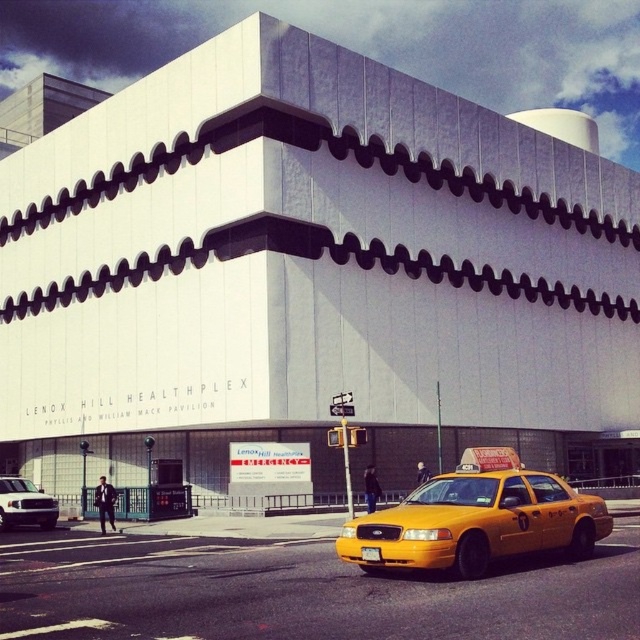
You are a delivery person who needs to park a vehicle that is 2 meters wide. You see the yellow matte taxi at center and the white matte truck at lower left. Which vehicle can accommodate your delivery vehicle based on width?

The yellow matte taxi at center has a larger width than the white matte truck at lower left, so the delivery vehicle that is 2 meters wide can fit in the yellow matte taxi at center parking space.

You are a delivery person who needs to park your vehicle in a space that can accommodate your truck. You see the yellow matte taxi at center and the white matte truck at lower left. Which vehicle takes up more space?

The yellow matte taxi at center is bigger than the white matte truck at lower left, so it takes up more space.

You are standing in front of the Lenox Hill Healthplex building and want to locate two specific points on its facade. The first point is at coordinates point (x=468, y=504) and the second is at point (x=29, y=504). Which of these two points is closer to you?

Point (x=468, y=504) is closer to the viewer than point (x=29, y=504).